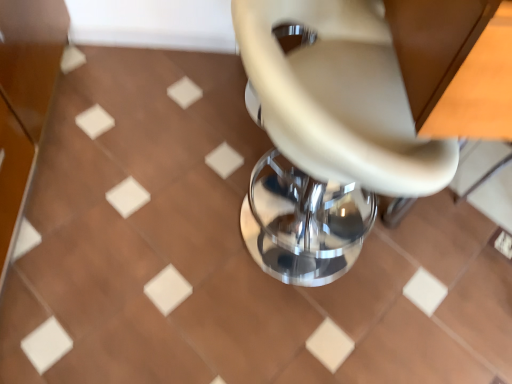
What is the approximate width of beige leather chair at center?

beige leather chair at center is 49.59 centimeters in width.

Image resolution: width=512 pixels, height=384 pixels. I want to click on beige leather chair at center, so click(327, 134).

What do you see at coordinates (327, 134) in the screenshot? The height and width of the screenshot is (384, 512). I see `beige leather chair at center` at bounding box center [327, 134].

Where is `beige leather chair at center`? This screenshot has height=384, width=512. beige leather chair at center is located at coordinates (327, 134).